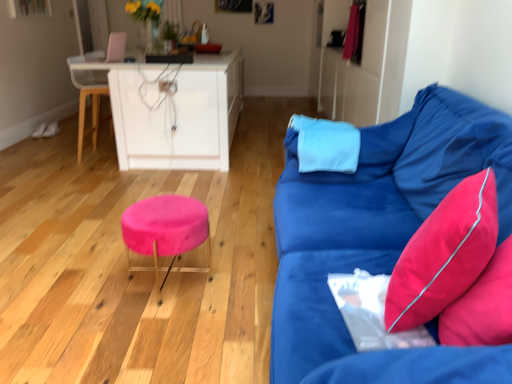
This screenshot has height=384, width=512. I want to click on vacant point above velvet pink stool at center (from a real-world perspective), so click(158, 206).